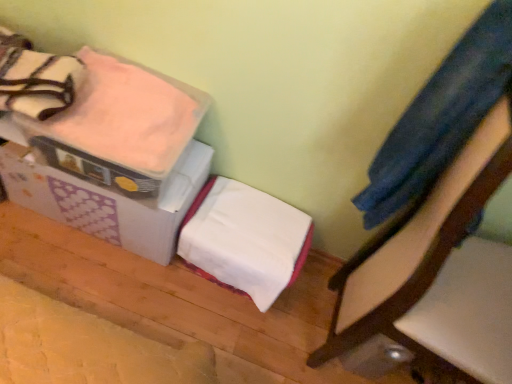
Question: From the image's perspective, does pink soft fabric blanket at upper left, the 1th blanket in the top-to-bottom sequence, appear higher than wooden chair at right?

Choices:
 (A) yes
 (B) no

Answer: (A)

Question: From a real-world perspective, is pink soft fabric blanket at upper left, the 1th blanket in the top-to-bottom sequence, positioned under wooden chair at right based on gravity?

Choices:
 (A) yes
 (B) no

Answer: (A)

Question: Is pink soft fabric blanket at upper left, the 1th blanket in the top-to-bottom sequence, shorter than wooden chair at right?

Choices:
 (A) no
 (B) yes

Answer: (B)

Question: Can you confirm if pink soft fabric blanket at upper left, the second blanket when ordered from bottom to top, is taller than wooden chair at right?

Choices:
 (A) no
 (B) yes

Answer: (A)

Question: Does pink soft fabric blanket at upper left, the second blanket when ordered from bottom to top, appear on the right side of wooden chair at right?

Choices:
 (A) yes
 (B) no

Answer: (B)

Question: Would you say denim fabric pants at upper right is to the left or to the right of wooden chair at right in the picture?

Choices:
 (A) left
 (B) right

Answer: (A)

Question: Is denim fabric pants at upper right spatially inside wooden chair at right, or outside of it?

Choices:
 (A) outside
 (B) inside

Answer: (B)

Question: Considering the positions of point (433, 125) and point (454, 213), is point (433, 125) closer or farther from the camera than point (454, 213)?

Choices:
 (A) farther
 (B) closer

Answer: (A)

Question: From a real-world perspective, relative to wooden chair at right, is denim fabric pants at upper right vertically above or below?

Choices:
 (A) above
 (B) below

Answer: (A)

Question: Which is correct: denim fabric pants at upper right is inside pink soft fabric blanket at upper left, the 1th blanket in the top-to-bottom sequence, or outside of it?

Choices:
 (A) inside
 (B) outside

Answer: (B)

Question: From the image's perspective, relative to pink soft fabric blanket at upper left, the second blanket when ordered from bottom to top, is denim fabric pants at upper right above or below?

Choices:
 (A) above
 (B) below

Answer: (B)

Question: Would you say denim fabric pants at upper right is to the left or to the right of pink soft fabric blanket at upper left, the second blanket when ordered from bottom to top, in the picture?

Choices:
 (A) right
 (B) left

Answer: (A)

Question: Considering their positions, is denim fabric pants at upper right located in front of or behind pink soft fabric blanket at upper left, the 1th blanket in the top-to-bottom sequence?

Choices:
 (A) front
 (B) behind

Answer: (A)

Question: Is pink soft fabric blanket at upper left, the second blanket when ordered from bottom to top, wider or thinner than white soft blanket at center, the 2th blanket viewed from the top?

Choices:
 (A) wide
 (B) thin

Answer: (A)

Question: Is pink soft fabric blanket at upper left, the 1th blanket in the top-to-bottom sequence, inside the boundaries of white soft blanket at center, marked as the first blanket in a bottom-to-top arrangement, or outside?

Choices:
 (A) inside
 (B) outside

Answer: (B)